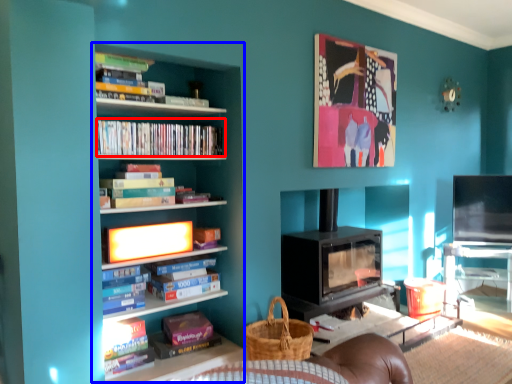
Question: Which point is closer to the camera, book (highlighted by a red box) or bookcase (highlighted by a blue box)?

Choices:
 (A) book
 (B) bookcase

Answer: (B)